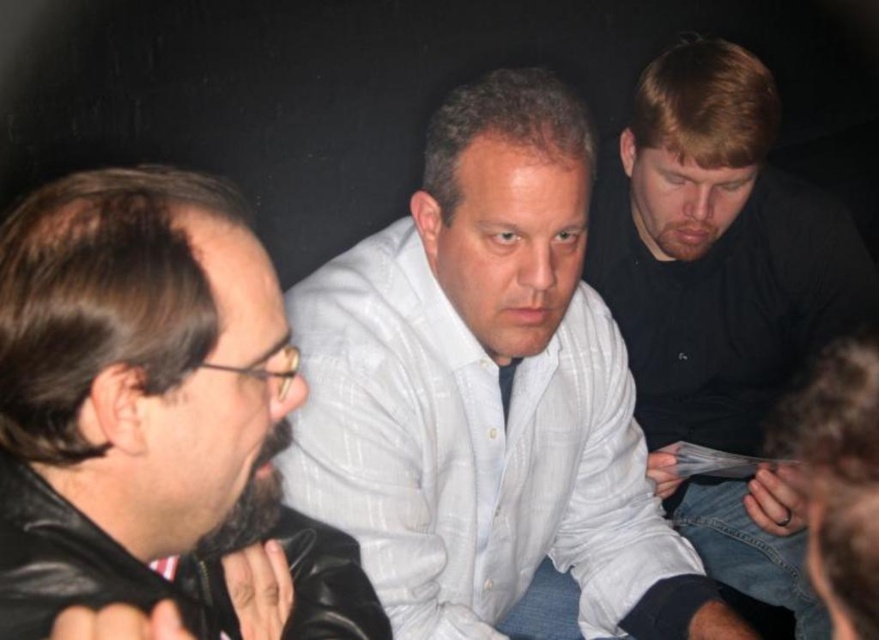
Is black leather jacket at left to the left of black matte shirt at upper right from the viewer's perspective?

Correct, you'll find black leather jacket at left to the left of black matte shirt at upper right.

Is point (171, 298) positioned before point (754, 116)?

Yes, point (171, 298) is closer to viewer.

Who is more distant from viewer, (233, 352) or (631, 214)?

Point (631, 214)

The image size is (879, 640). I want to click on black leather jacket at left, so click(x=154, y=417).

Which is above, white striped shirt at center or black matte shirt at upper right?

Positioned higher is black matte shirt at upper right.

Can you confirm if white striped shirt at center is wider than black matte shirt at upper right?

Yes.

Between point (518, 461) and point (747, 273), which one is positioned in front?

Point (518, 461)

At what (x,y) coordinates should I click in order to perform the action: click on white striped shirt at center. Please return your answer as a coordinate pair (x, y). This screenshot has height=640, width=879. Looking at the image, I should click on (487, 392).

How far apart are white striped shirt at center and black leather jacket at left?

A distance of 14.54 inches exists between white striped shirt at center and black leather jacket at left.

Can you confirm if white striped shirt at center is smaller than black leather jacket at left?

No.

Measure the distance between white striped shirt at center and camera.

A distance of 36.42 inches exists between white striped shirt at center and camera.

Image resolution: width=879 pixels, height=640 pixels. What are the coordinates of `white striped shirt at center` in the screenshot? It's located at (487, 392).